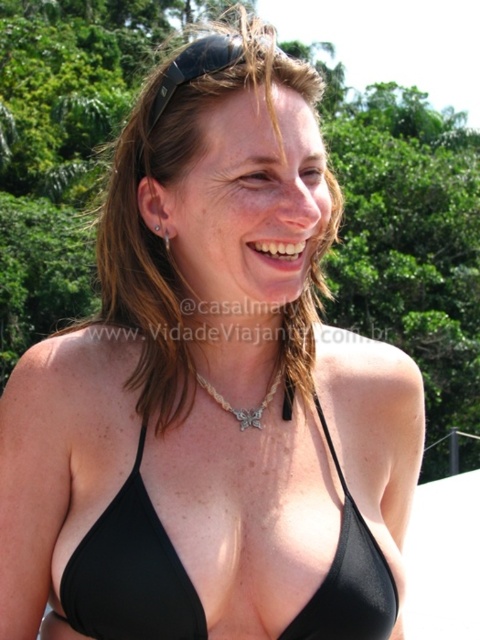
You are a photographer trying to capture the perfect shot of the two points in the scene. Which point, point (228, 49) or point (245, 412), would appear larger in your photo?

Point (228, 49) is closer to the camera than point (245, 412), so it would appear larger in the photo.

You are a photographer taking a portrait of the woman. You notice the black fabric bikini top at center and the silver metallic chain at center. Which item is closer to the camera lens?

The black fabric bikini top at center is positioned under the silver metallic chain at center, so the silver metallic chain at center is closer to the camera lens.

You are a photographer trying to capture the woman in the scene. You want to position your camera so that the black fabric bikini top at center is to the left of the silver metallic chain at center in the photo. Is this possible based on their current positions?

Yes, because the black fabric bikini top at center is already positioned to the left of the silver metallic chain at center as described in the scene.